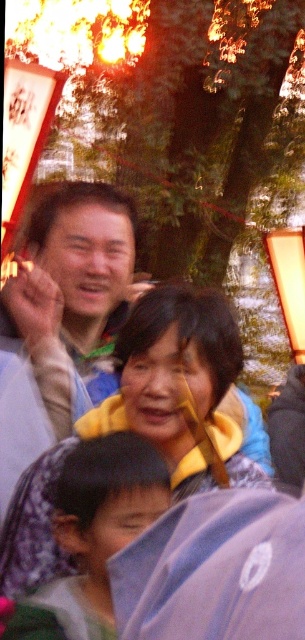
Question: Among these points, which one is nearest to the camera?

Choices:
 (A) (32, 445)
 (B) (233, 563)

Answer: (B)

Question: Is matte gray shirt at center to the left of blue fabric umbrella at lower center from the viewer's perspective?

Choices:
 (A) no
 (B) yes

Answer: (B)

Question: Does matte gray shirt at center have a larger size compared to blue fabric umbrella at lower center?

Choices:
 (A) yes
 (B) no

Answer: (A)

Question: Among these objects, which one is farthest from the camera?

Choices:
 (A) blue fabric umbrella at lower center
 (B) matte gray shirt at center

Answer: (B)

Question: Does matte gray shirt at center appear on the right side of blue fabric umbrella at lower center?

Choices:
 (A) no
 (B) yes

Answer: (A)